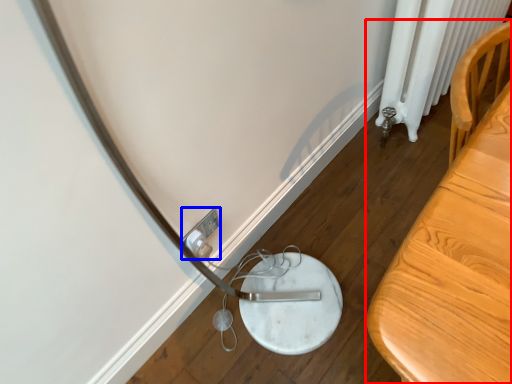
Question: Which object is further to the camera taking this photo, furniture (highlighted by a red box) or electric outlet (highlighted by a blue box)?

Choices:
 (A) furniture
 (B) electric outlet

Answer: (B)